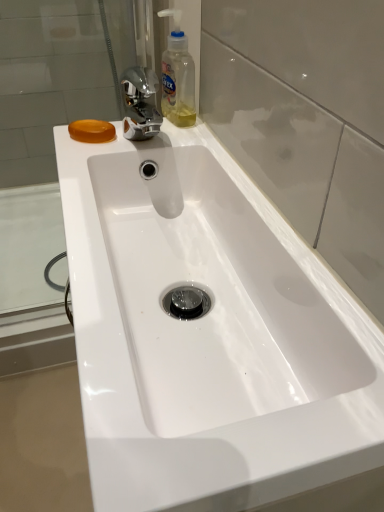
Question: Is transparent glass door at center placed right next to translucent plastic bottle at upper center?

Choices:
 (A) no
 (B) yes

Answer: (A)

Question: Is transparent glass door at center smaller than translucent plastic bottle at upper center?

Choices:
 (A) no
 (B) yes

Answer: (A)

Question: Can you confirm if transparent glass door at center is positioned to the left of translucent plastic bottle at upper center?

Choices:
 (A) no
 (B) yes

Answer: (A)

Question: Is transparent glass door at center completely or partially outside of translucent plastic bottle at upper center?

Choices:
 (A) no
 (B) yes

Answer: (B)

Question: Is transparent glass door at center to the right of translucent plastic bottle at upper center from the viewer's perspective?

Choices:
 (A) no
 (B) yes

Answer: (B)

Question: From the image's perspective, relative to translucent plastic bottle at upper center, is orange translucent soap at upper left above or below?

Choices:
 (A) below
 (B) above

Answer: (A)

Question: Is orange translucent soap at upper left inside or outside of translucent plastic bottle at upper center?

Choices:
 (A) outside
 (B) inside

Answer: (A)

Question: From a real-world perspective, is orange translucent soap at upper left physically located above or below translucent plastic bottle at upper center?

Choices:
 (A) below
 (B) above

Answer: (A)

Question: Is orange translucent soap at upper left bigger or smaller than translucent plastic bottle at upper center?

Choices:
 (A) small
 (B) big

Answer: (A)

Question: In the image, is orange translucent soap at upper left positioned in front of or behind transparent glass door at center?

Choices:
 (A) behind
 (B) front

Answer: (A)

Question: Is orange translucent soap at upper left bigger or smaller than transparent glass door at center?

Choices:
 (A) small
 (B) big

Answer: (A)

Question: Visually, is orange translucent soap at upper left positioned to the left or to the right of transparent glass door at center?

Choices:
 (A) right
 (B) left

Answer: (B)

Question: Is orange translucent soap at upper left wider or thinner than transparent glass door at center?

Choices:
 (A) wide
 (B) thin

Answer: (A)

Question: In terms of height, does translucent plastic bottle at upper center look taller or shorter compared to transparent glass door at center?

Choices:
 (A) short
 (B) tall

Answer: (A)

Question: Is point click(168, 111) positioned closer to the camera than point click(327, 119)?

Choices:
 (A) farther
 (B) closer

Answer: (A)